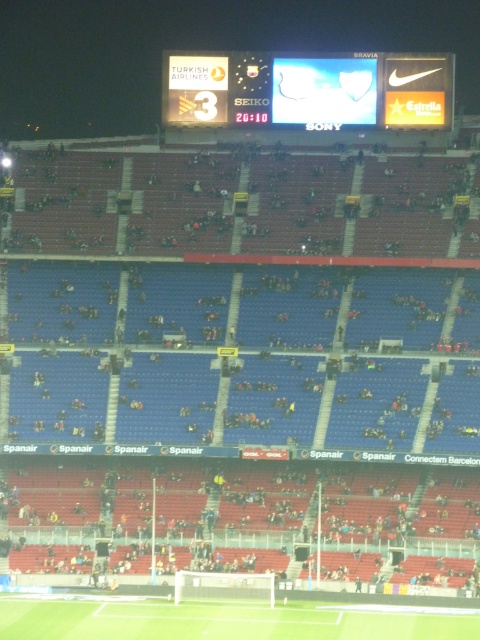
You are a photographer trying to capture the entire soccer field and the scoreboard in one shot. Given that the white glossy scoreboard at upper center is much taller than the green grass football field at lower center, would you need to adjust your camera angle to include both?

Yes, you would need to adjust your camera angle to include both the white glossy scoreboard at upper center and the green grass football field at lower center because the scoreboard is much taller than the field.

You are a photographer trying to capture the entire soccer field and the scoreboard in one shot. Based on the scene, where should you position yourself to ensure both the white glossy scoreboard at upper center and the green grass football field at lower center are visible in your frame?

Position yourself to the left of the green grass football field at lower center so that the white glossy scoreboard at upper center, which is to the right of the field, can be captured in the same frame.